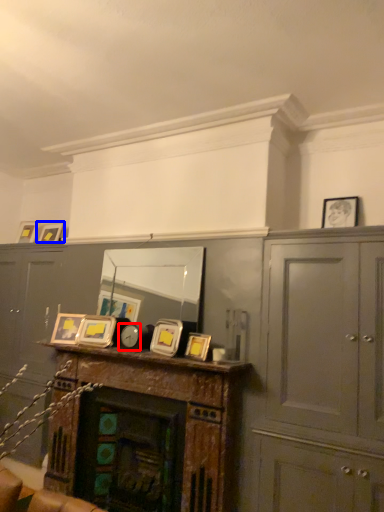
Question: Which point is further to the camera, clock (highlighted by a red box) or picture frame (highlighted by a blue box)?

Choices:
 (A) clock
 (B) picture frame

Answer: (B)